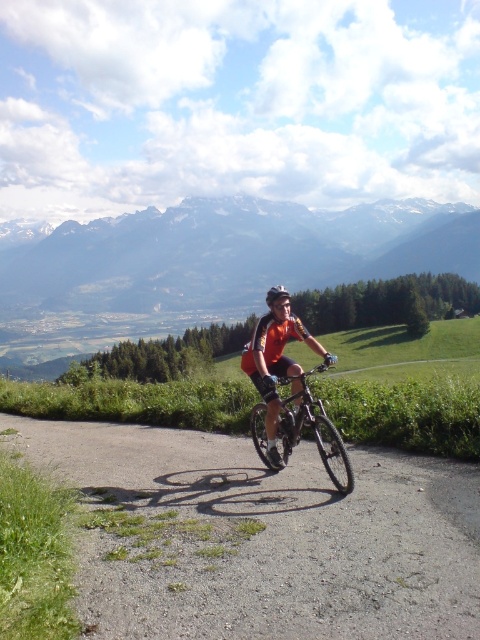
Based on the photo, is gray asphalt road at center to the right of matte black helmet at center from the viewer's perspective?

In fact, gray asphalt road at center is to the left of matte black helmet at center.

Who is positioned more to the left, gray asphalt road at center or matte black helmet at center?

gray asphalt road at center is more to the left.

At what (x,y) coordinates should I click in order to perform the action: click on gray asphalt road at center. Please return your answer as a coordinate pair (x, y). Image resolution: width=480 pixels, height=640 pixels. Looking at the image, I should click on (268, 538).

Does gray asphalt road at center appear on the left side of snowy mountain range at upper center?

No, gray asphalt road at center is not to the left of snowy mountain range at upper center.

Is the position of gray asphalt road at center more distant than that of snowy mountain range at upper center?

No, gray asphalt road at center is closer to the viewer.

Between point (146, 577) and point (471, 225), which one is positioned in front?

Point (146, 577) is more forward.

The height and width of the screenshot is (640, 480). Identify the location of gray asphalt road at center. (268, 538).

Between snowy mountain range at upper center and shiny metallic bicycle at center, which one appears on the right side from the viewer's perspective?

Positioned to the right is shiny metallic bicycle at center.

Between point (95, 310) and point (312, 401), which one is positioned in front?

Point (312, 401) is in front.

The width and height of the screenshot is (480, 640). In order to click on snowy mountain range at upper center in this screenshot , I will do `click(228, 253)`.